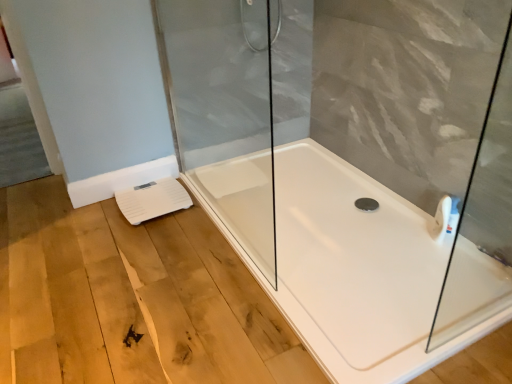
This screenshot has height=384, width=512. Identify the location of free space in front of white plastic scale at lower left. (145, 235).